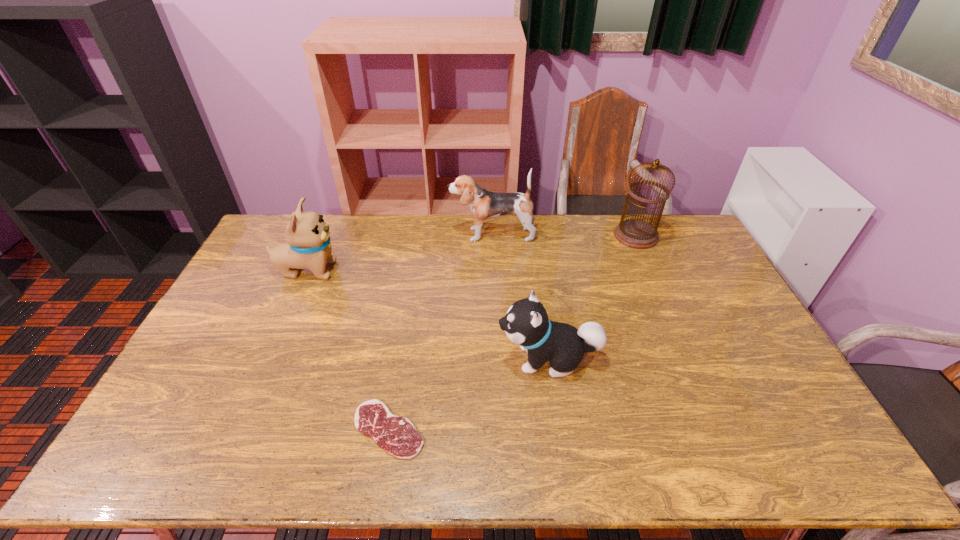
What are the coordinates of `birdcage` in the screenshot? It's located at (638, 234).

At what (x,y) coordinates should I click in order to perform the action: click on the farthest puppy. Please return your answer as a coordinate pair (x, y). The image size is (960, 540). Looking at the image, I should click on (484, 204).

Identify the location of the second nearest puppy. (308, 245).

This screenshot has height=540, width=960. Find the location of `the leftmost object`. the leftmost object is located at coordinates (308, 245).

In order to click on the nearest puppy in this screenshot , I will do `click(526, 324)`.

Where is `the second shortest object`? This screenshot has height=540, width=960. the second shortest object is located at coordinates (526, 324).

Find the location of a particular element. the shortest object is located at coordinates (397, 435).

Find the location of a particular element. The image size is (960, 540). steak is located at coordinates (397, 435).

Identify the location of free space located 0.260m on the front-facing side of the rightmost object. (663, 299).

You are a GUI agent. You are given a task and a screenshot of the screen. Output one action in this format:
    pyautogui.click(x=<x>, y=<y>)
    Task: Click on the vacant space located 0.380m at the face of the farthest puppy
    The height and width of the screenshot is (540, 960).
    Given the screenshot: What is the action you would take?
    pyautogui.click(x=351, y=234)